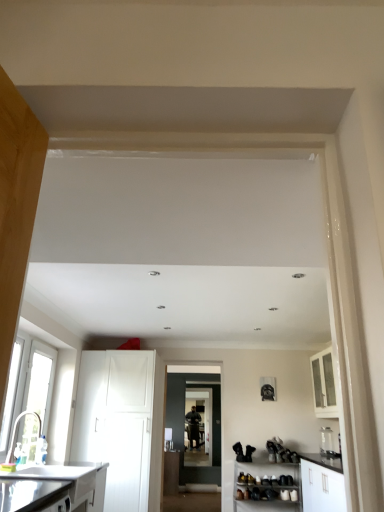
Question: Does white plastic window at left, which appears as the first window when viewed from the back, have a greater width compared to matte black door at center?

Choices:
 (A) yes
 (B) no

Answer: (B)

Question: Does white plastic window at left, which appears as the first window when viewed from the back, lie in front of matte black door at center?

Choices:
 (A) no
 (B) yes

Answer: (B)

Question: Could you tell me if white plastic window at left, placed as the 2th window when sorted from front to back, is turned towards matte black door at center?

Choices:
 (A) yes
 (B) no

Answer: (B)

Question: Is the depth of white plastic window at left, placed as the 2th window when sorted from front to back, greater than that of matte black door at center?

Choices:
 (A) no
 (B) yes

Answer: (A)

Question: Does white plastic window at left, which appears as the first window when viewed from the back, appear on the right side of matte black door at center?

Choices:
 (A) yes
 (B) no

Answer: (B)

Question: Is point (3, 412) positioned closer to the camera than point (210, 389)?

Choices:
 (A) closer
 (B) farther

Answer: (A)

Question: In terms of height, does clear glass window at left, the 1th window from the front, look taller or shorter compared to matte black door at center?

Choices:
 (A) short
 (B) tall

Answer: (A)

Question: Do you think clear glass window at left, marked as the 2th window in a back-to-front arrangement, is within matte black door at center, or outside of it?

Choices:
 (A) inside
 (B) outside

Answer: (B)

Question: Is clear glass window at left, marked as the 2th window in a back-to-front arrangement, in front of or behind matte black door at center in the image?

Choices:
 (A) front
 (B) behind

Answer: (A)

Question: Based on their sizes in the image, would you say brushed metal sink at lower left is bigger or smaller than transparent glass door at center?

Choices:
 (A) big
 (B) small

Answer: (B)

Question: Considering the positions of brushed metal sink at lower left and transparent glass door at center in the image, is brushed metal sink at lower left taller or shorter than transparent glass door at center?

Choices:
 (A) short
 (B) tall

Answer: (A)

Question: From a real-world perspective, is brushed metal sink at lower left physically located above or below transparent glass door at center?

Choices:
 (A) below
 (B) above

Answer: (A)

Question: From the image's perspective, is brushed metal sink at lower left positioned above or below transparent glass door at center?

Choices:
 (A) above
 (B) below

Answer: (A)

Question: Is clear glass jar at lower right in front of or behind transparent glass door at center in the image?

Choices:
 (A) front
 (B) behind

Answer: (A)

Question: Is clear glass jar at lower right bigger or smaller than transparent glass door at center?

Choices:
 (A) small
 (B) big

Answer: (A)